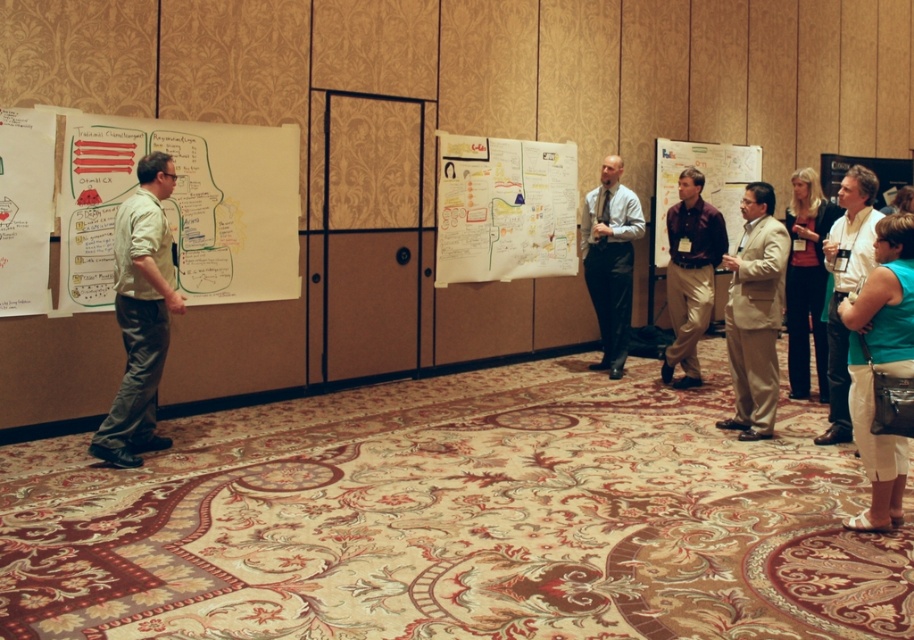
Question: Which of the following is the closest to the observer?

Choices:
 (A) (689, 202)
 (B) (3, 268)
 (C) (777, 394)

Answer: (B)

Question: Is white paper at left positioned before matte gray suit at center?

Choices:
 (A) no
 (B) yes

Answer: (B)

Question: From the image, what is the correct spatial relationship of light beige shirt at left in relation to tan fabric suit at center?

Choices:
 (A) right
 (B) left

Answer: (B)

Question: Based on their relative distances, which object is farther from the whiteboard with marker drawings at left?

Choices:
 (A) green fabric purse at lower right
 (B) matte gray suit at center

Answer: (A)

Question: Is green fabric purse at lower right positioned at the back of tan fabric suit at center?

Choices:
 (A) no
 (B) yes

Answer: (A)

Question: Among these objects, which one is nearest to the camera?

Choices:
 (A) tan fabric suit at center
 (B) white paper at left
 (C) light beige shirt at left
 (D) matte gray suit at center

Answer: (C)